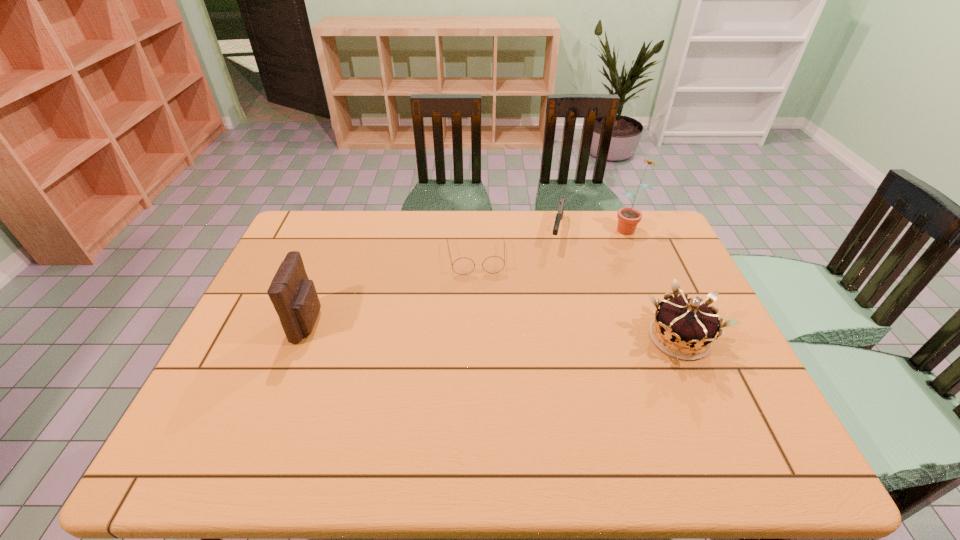
Where is `vacant space located 0.230m on the temples of the spectacles`? The width and height of the screenshot is (960, 540). vacant space located 0.230m on the temples of the spectacles is located at coordinates (483, 333).

The width and height of the screenshot is (960, 540). What are the coordinates of `vacant space positioned 0.360m on the temples of the spectacles` in the screenshot? It's located at [x=488, y=373].

Where is `vacant region located on the temples of the spectacles`? The image size is (960, 540). vacant region located on the temples of the spectacles is located at coordinates (483, 330).

Locate an element on the screen. This screenshot has height=540, width=960. vacant area situated 0.110m at the muzzle end of the second shortest object is located at coordinates coord(554,272).

Image resolution: width=960 pixels, height=540 pixels. Find the location of `vacant space located at the muzzle end of the second shortest object`. vacant space located at the muzzle end of the second shortest object is located at coordinates [541, 334].

The image size is (960, 540). Identify the location of free space located 0.250m at the muzzle end of the second shortest object. (548, 303).

At what (x,y) coordinates should I click in order to perform the action: click on free location located 0.140m on the flower of the sunflower. Please return your answer as a coordinate pair (x, y). Image resolution: width=960 pixels, height=540 pixels. Looking at the image, I should click on (604, 256).

This screenshot has width=960, height=540. Identify the location of free space located 0.180m on the flower of the sunflower. pyautogui.click(x=599, y=262).

Find the location of a particular element. This screenshot has height=540, width=960. blank area located on the flower of the sunflower is located at coordinates (568, 297).

The width and height of the screenshot is (960, 540). Identify the location of spectacles at the far edge. (493, 264).